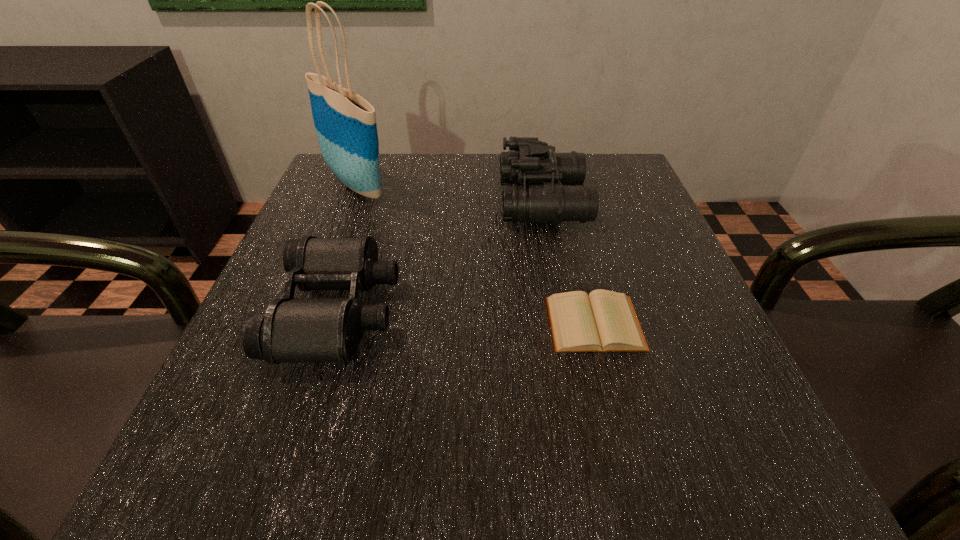
This screenshot has height=540, width=960. I want to click on free space that satisfies the following two spatial constraints: 1. through the eyepieces of the diary; 2. on the right side of the left binoculars, so pos(334,323).